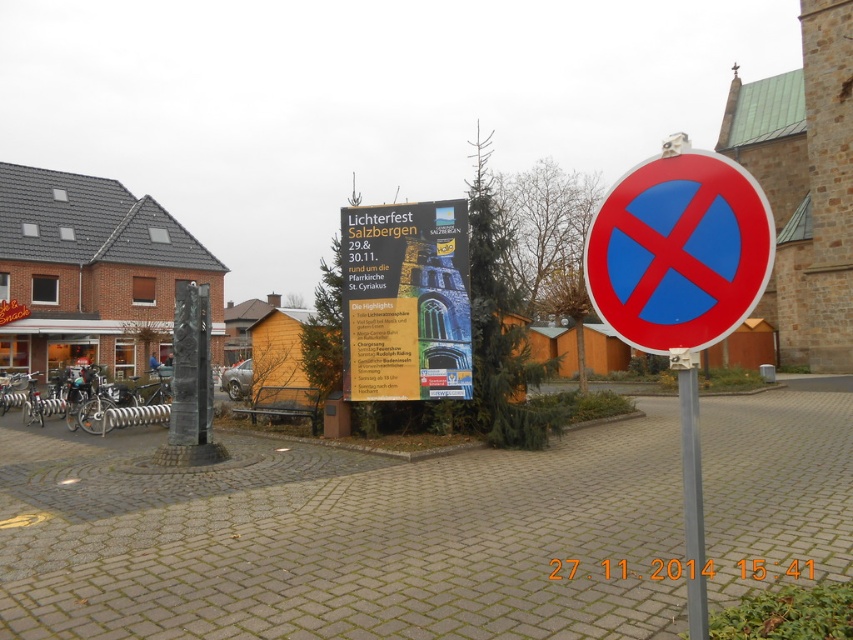
Question: Does red plastic circle at right have a smaller size compared to silver metallic pole at center?

Choices:
 (A) yes
 (B) no

Answer: (A)

Question: Which is farther from the red plastic sign at center?

Choices:
 (A) red plastic circle at right
 (B) white paper poster at center

Answer: (B)

Question: From the image, what is the correct spatial relationship of red plastic sign at center in relation to white paper poster at center?

Choices:
 (A) above
 (B) below

Answer: (B)

Question: Is red plastic sign at center bigger than silver metallic pole at center?

Choices:
 (A) yes
 (B) no

Answer: (B)

Question: Which is nearer to the silver metallic pole at center?

Choices:
 (A) red plastic circle at right
 (B) white paper poster at center
 (C) red plastic sign at center

Answer: (A)

Question: Among these objects, which one is nearest to the camera?

Choices:
 (A) red plastic sign at center
 (B) silver metallic pole at center

Answer: (B)